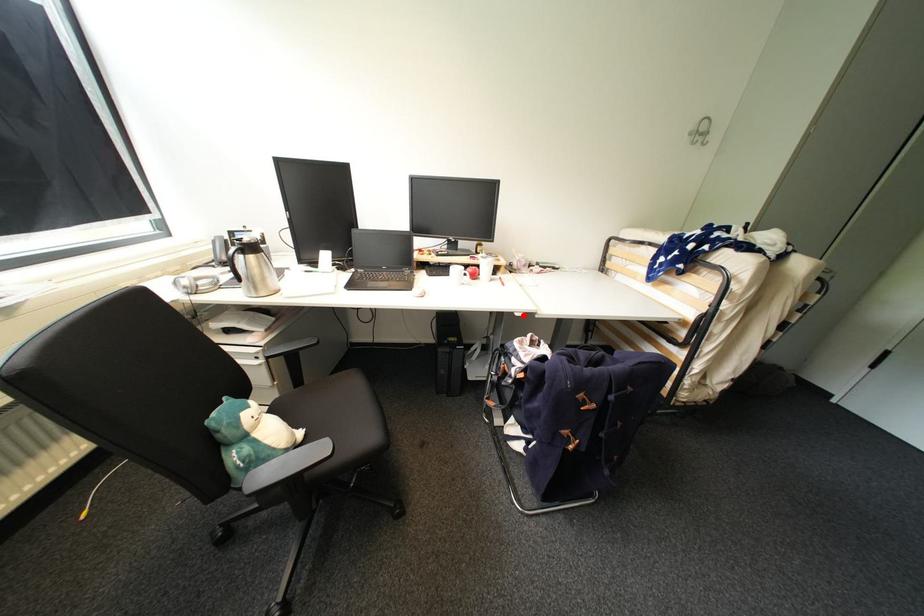
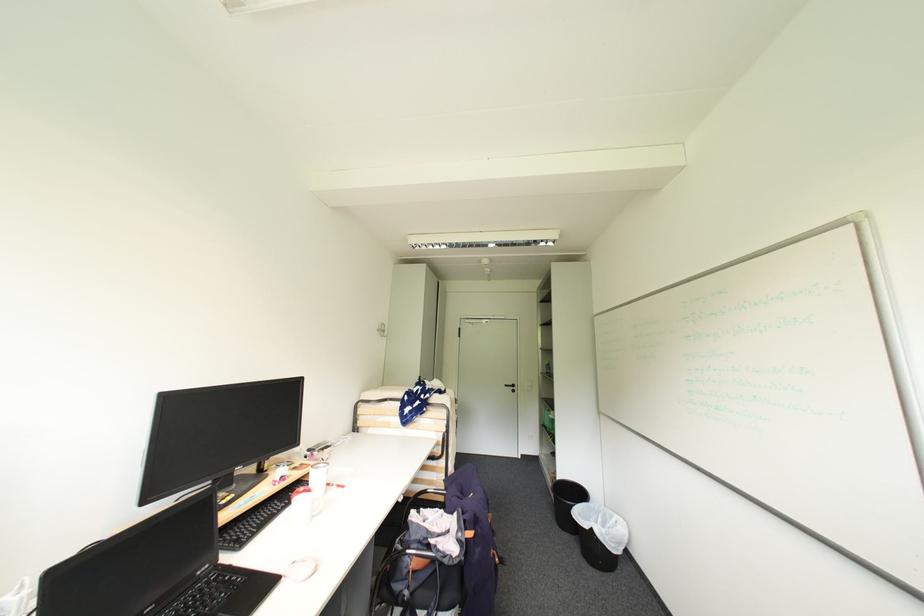
In the second image, find the point that corresponds to the highlighted location in the first image.

(407, 501)